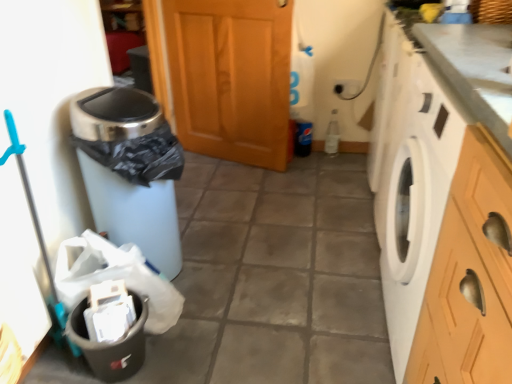
You are a GUI agent. You are given a task and a screenshot of the screen. Output one action in this format:
    pyautogui.click(x=<x>, y=<y>)
    Task: Click on the vacant area that is situated to the right of black plastic recycling bin at lower left
    Image resolution: width=512 pixels, height=384 pixels.
    Given the screenshot: What is the action you would take?
    click(189, 348)